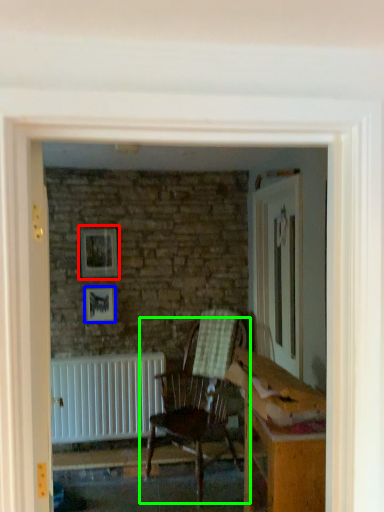
Question: Which is nearer to the picture frame (highlighted by a red box)? picture frame (highlighted by a blue box) or chair (highlighted by a green box).

Choices:
 (A) picture frame
 (B) chair

Answer: (A)